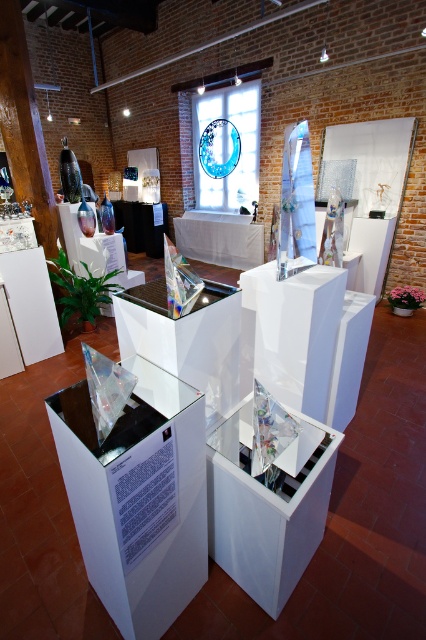
How distant is transparent glass sculpture at center from transparent glass table at center?

transparent glass sculpture at center and transparent glass table at center are 36.79 centimeters apart from each other.

At what (x,y) coordinates should I click in order to perform the action: click on transparent glass sculpture at center. Please return your answer as a coordinate pair (x, y). Looking at the image, I should click on (138, 497).

This screenshot has width=426, height=640. In order to click on transparent glass sculpture at center in this screenshot , I will do `click(138, 497)`.